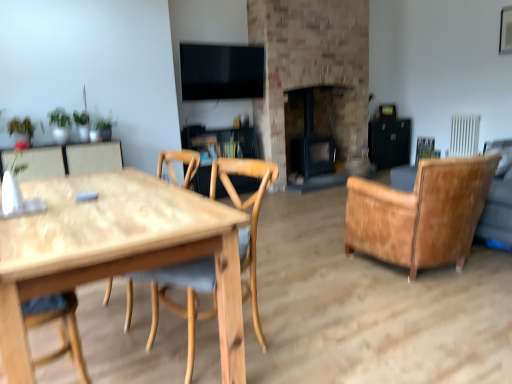
What do you see at coordinates (312, 72) in the screenshot? I see `brick fireplace at center, arranged as the first fireplace when viewed from the right` at bounding box center [312, 72].

Identify the location of natural wood chair at center, which is the 2th chair from back to front. (178, 287).

Where is `black matte fireplace at center, which is the first fireplace from left to right`? black matte fireplace at center, which is the first fireplace from left to right is located at coordinates (313, 153).

Between brick fireplace at center, arranged as the first fireplace when viewed from the right, and natural wood table at left, which one appears on the right side from the viewer's perspective?

brick fireplace at center, arranged as the first fireplace when viewed from the right.

Does brick fireplace at center, arranged as the 2th fireplace when viewed from the left, have a larger size compared to natural wood table at left?

Indeed, brick fireplace at center, arranged as the 2th fireplace when viewed from the left, has a larger size compared to natural wood table at left.

Based on the photo, is brick fireplace at center, arranged as the first fireplace when viewed from the right, positioned behind natural wood table at left?

Yes, brick fireplace at center, arranged as the first fireplace when viewed from the right, is further from the camera.

Which object is wider, brick fireplace at center, arranged as the first fireplace when viewed from the right, or natural wood table at left?

natural wood table at left.

Does black matte fireplace at center, which is the first fireplace from left to right, lie in front of natural wood table at left?

No, black matte fireplace at center, which is the first fireplace from left to right, is further to the viewer.

Is black matte fireplace at center, which ranks as the second fireplace in right-to-left order, facing towards natural wood table at left?

No, black matte fireplace at center, which ranks as the second fireplace in right-to-left order, does not turn towards natural wood table at left.

You are a GUI agent. You are given a task and a screenshot of the screen. Output one action in this format:
    pyautogui.click(x=<x>, y=<y>)
    Task: Click on the round table in front of the black matte fireplace at center, which ranks as the second fireplace in right-to-left order
    
    Given the screenshot: What is the action you would take?
    pyautogui.click(x=115, y=251)

Which of these two, black matte fireplace at center, which ranks as the second fireplace in right-to-left order, or natural wood table at left, stands taller?

Standing taller between the two is black matte fireplace at center, which ranks as the second fireplace in right-to-left order.

From a real-world perspective, is leather armchair at right, which is the second chair from left to right, located beneath natural wood chair at center, which is the 2th chair from back to front?

Yes, from a real-world perspective, leather armchair at right, which is the second chair from left to right, is below natural wood chair at center, which is the 2th chair from back to front.

Are leather armchair at right, the 1th chair viewed from the right, and natural wood chair at center, which is the 2th chair from back to front, making contact?

No, leather armchair at right, the 1th chair viewed from the right, is not with natural wood chair at center, which is the 2th chair from back to front.

Is point (403, 249) positioned behind point (170, 306)?

That is True.

At what (x,y) coordinates should I click in order to perform the action: click on chair on the left of leather armchair at right, the 1th chair viewed from the back. Please return your answer as a coordinate pair (x, y). The image size is (512, 384). Looking at the image, I should click on (178, 287).

From the image's perspective, which one is positioned higher, brick fireplace at center, arranged as the first fireplace when viewed from the right, or natural wood chair at center, which is the 1th chair in front-to-back order?

brick fireplace at center, arranged as the first fireplace when viewed from the right, from the image's perspective.

Identify the location of the 2nd fireplace to the right of the natural wood chair at center, which is the 2th chair from back to front, starting your count from the anchor. (312, 72).

Is natural wood chair at center, which is the 1th chair in front-to-back order, located within brick fireplace at center, arranged as the first fireplace when viewed from the right?

No, natural wood chair at center, which is the 1th chair in front-to-back order, is not surrounded by brick fireplace at center, arranged as the first fireplace when viewed from the right.

What's the angular difference between brick fireplace at center, arranged as the first fireplace when viewed from the right, and natural wood chair at center, which is the 2th chair from back to front,'s facing directions?

The facing directions of brick fireplace at center, arranged as the first fireplace when viewed from the right, and natural wood chair at center, which is the 2th chair from back to front, are 88.4 degrees apart.

Is brick fireplace at center, arranged as the 2th fireplace when viewed from the left, situated inside black matte fireplace at center, which ranks as the second fireplace in right-to-left order, or outside?

brick fireplace at center, arranged as the 2th fireplace when viewed from the left, is not enclosed by black matte fireplace at center, which ranks as the second fireplace in right-to-left order.

From a real-world perspective, is brick fireplace at center, arranged as the first fireplace when viewed from the right, below black matte fireplace at center, which ranks as the second fireplace in right-to-left order?

No, from a real-world perspective, brick fireplace at center, arranged as the first fireplace when viewed from the right, is not beneath black matte fireplace at center, which ranks as the second fireplace in right-to-left order.

Consider the image. From the image's perspective, which is below, brick fireplace at center, arranged as the first fireplace when viewed from the right, or black matte fireplace at center, which ranks as the second fireplace in right-to-left order?

From the image's view, black matte fireplace at center, which ranks as the second fireplace in right-to-left order, is below.

Can you tell me how much natural wood chair at center, which is the 1th chair in front-to-back order, and black matte fireplace at center, which ranks as the second fireplace in right-to-left order, differ in facing direction?

The angular difference between natural wood chair at center, which is the 1th chair in front-to-back order, and black matte fireplace at center, which ranks as the second fireplace in right-to-left order, is 88.4 degrees.

Can you see natural wood chair at center, positioned as the 2th chair in right-to-left order, touching black matte fireplace at center, which ranks as the second fireplace in right-to-left order?

No.

Which object is further away from the camera taking this photo, natural wood chair at center, positioned as the 2th chair in right-to-left order, or black matte fireplace at center, which is the first fireplace from left to right?

Positioned behind is black matte fireplace at center, which is the first fireplace from left to right.

From the picture: Is natural wood chair at center, positioned as the 2th chair in right-to-left order, facing away from black matte fireplace at center, which is the first fireplace from left to right?

That's not correct — natural wood chair at center, positioned as the 2th chair in right-to-left order, is not looking away from black matte fireplace at center, which is the first fireplace from left to right.

Is brick fireplace at center, arranged as the first fireplace when viewed from the right, located outside leather armchair at right, the 1th chair viewed from the back?

Indeed, brick fireplace at center, arranged as the first fireplace when viewed from the right, is completely outside leather armchair at right, the 1th chair viewed from the back.

Does brick fireplace at center, arranged as the first fireplace when viewed from the right, have a lesser height compared to leather armchair at right, the second chair in the front-to-back sequence?

No.

From the image's perspective, does brick fireplace at center, arranged as the first fireplace when viewed from the right, appear lower than leather armchair at right, which is the second chair from left to right?

No, from the image's perspective, brick fireplace at center, arranged as the first fireplace when viewed from the right, is not beneath leather armchair at right, which is the second chair from left to right.

Where is `the 2nd fireplace positioned above the natural wood table at left (from a real-world perspective)`? The width and height of the screenshot is (512, 384). the 2nd fireplace positioned above the natural wood table at left (from a real-world perspective) is located at coordinates (312, 72).

Locate an element on the screen. The height and width of the screenshot is (384, 512). fireplace that is the 1st object located above the natural wood table at left (from the image's perspective) is located at coordinates (313, 153).

From the image, which object appears to be nearer to black matte fireplace at center, which ranks as the second fireplace in right-to-left order, brick fireplace at center, arranged as the 2th fireplace when viewed from the left, or leather armchair at right, which is the second chair from left to right?

The object closer to black matte fireplace at center, which ranks as the second fireplace in right-to-left order, is brick fireplace at center, arranged as the 2th fireplace when viewed from the left.

From the image, which object appears to be farther from black matte fireplace at center, which ranks as the second fireplace in right-to-left order, natural wood chair at center, which is the 1th chair in front-to-back order, or natural wood table at left?

Based on the image, natural wood table at left appears to be further to black matte fireplace at center, which ranks as the second fireplace in right-to-left order.

Considering their positions, is natural wood chair at center, positioned as the 2th chair in right-to-left order, positioned further to brick fireplace at center, arranged as the first fireplace when viewed from the right, than natural wood table at left?

natural wood table at left is further to brick fireplace at center, arranged as the first fireplace when viewed from the right.

Based on their spatial positions, is natural wood table at left or black matte fireplace at center, which ranks as the second fireplace in right-to-left order, further from natural wood chair at center, positioned as the 2th chair in right-to-left order?

Based on the image, black matte fireplace at center, which ranks as the second fireplace in right-to-left order, appears to be further to natural wood chair at center, positioned as the 2th chair in right-to-left order.

Which object lies further to the anchor point natural wood chair at center, which is the 2th chair from back to front, black matte fireplace at center, which ranks as the second fireplace in right-to-left order, or natural wood table at left?

black matte fireplace at center, which ranks as the second fireplace in right-to-left order, is positioned further to the anchor natural wood chair at center, which is the 2th chair from back to front.

From the picture: Which object lies nearer to the anchor point leather armchair at right, the 1th chair viewed from the back, brick fireplace at center, arranged as the first fireplace when viewed from the right, or black matte fireplace at center, which ranks as the second fireplace in right-to-left order?

black matte fireplace at center, which ranks as the second fireplace in right-to-left order, is positioned closer to the anchor leather armchair at right, the 1th chair viewed from the back.

From the image, which object appears to be farther from black matte fireplace at center, which is the first fireplace from left to right, leather armchair at right, the 1th chair viewed from the back, or natural wood chair at center, which is the 1th chair in front-to-back order?

natural wood chair at center, which is the 1th chair in front-to-back order, lies further to black matte fireplace at center, which is the first fireplace from left to right, than the other object.

Estimate the real-world distances between objects in this image. Which object is closer to black matte fireplace at center, which is the first fireplace from left to right, leather armchair at right, the 1th chair viewed from the back, or natural wood table at left?

leather armchair at right, the 1th chair viewed from the back, lies closer to black matte fireplace at center, which is the first fireplace from left to right, than the other object.

Locate an element on the screen. Image resolution: width=512 pixels, height=384 pixels. fireplace between natural wood chair at center, which is the 2th chair from back to front, and black matte fireplace at center, which is the first fireplace from left to right, in the front-back direction is located at coordinates (312, 72).

This screenshot has height=384, width=512. I want to click on chair between natural wood chair at center, which is the 2th chair from back to front, and black matte fireplace at center, which ranks as the second fireplace in right-to-left order, along the z-axis, so click(x=420, y=213).

This screenshot has width=512, height=384. I want to click on chair located between natural wood chair at center, which ranks as the first chair in left-to-right order, and brick fireplace at center, arranged as the 2th fireplace when viewed from the left, in the depth direction, so click(x=420, y=213).

At what (x,y) coordinates should I click in order to perform the action: click on fireplace positioned between natural wood table at left and black matte fireplace at center, which ranks as the second fireplace in right-to-left order, from near to far. Please return your answer as a coordinate pair (x, y). This screenshot has height=384, width=512. Looking at the image, I should click on (312, 72).